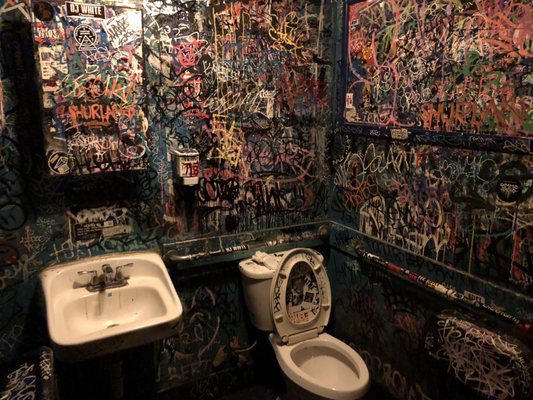
Identify the location of right underside of toilet seat. Image resolution: width=533 pixels, height=400 pixels. (278, 300).